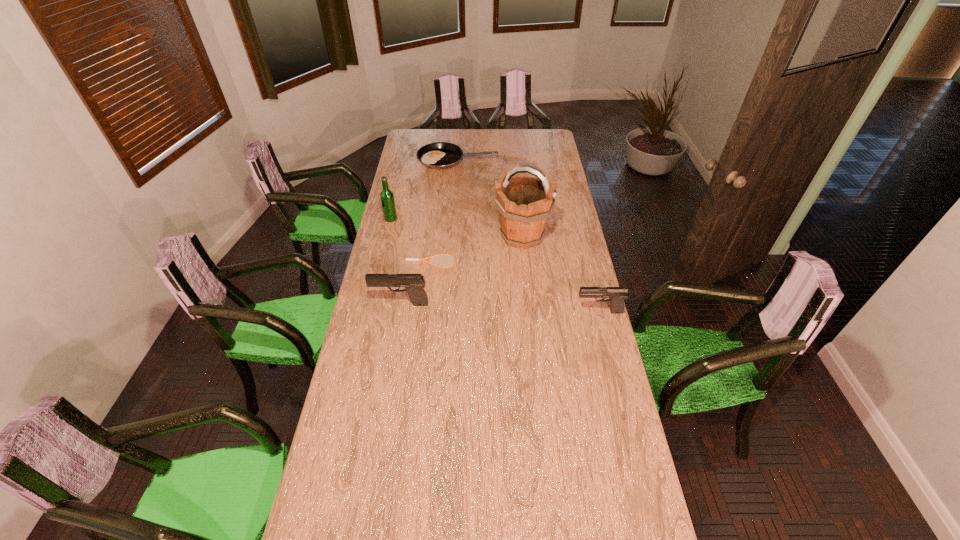
This screenshot has width=960, height=540. In order to click on free space located aim along the barrel of the shorter pistol in this screenshot , I will do `click(490, 312)`.

At what (x,y) coordinates should I click in order to perform the action: click on vacant space located 0.140m aim along the barrel of the shorter pistol. Please return your answer as a coordinate pair (x, y). This screenshot has width=960, height=540. Looking at the image, I should click on (540, 312).

The width and height of the screenshot is (960, 540). I want to click on blank space located 0.220m on the left of the bucket, so click(446, 237).

Locate an element on the screen. This screenshot has width=960, height=540. vacant space situated 0.050m on the left of the farthest object is located at coordinates (408, 160).

Where is `free region located on the front of the fifth shortest object`? free region located on the front of the fifth shortest object is located at coordinates (386, 239).

Where is `vacant region located on the front of the tennis racket`? vacant region located on the front of the tennis racket is located at coordinates (427, 285).

Find the location of a particular element. Image resolution: width=960 pixels, height=540 pixels. pistol present at the left edge is located at coordinates (414, 283).

Where is `frying pan that is at the left edge`? This screenshot has height=540, width=960. frying pan that is at the left edge is located at coordinates (440, 155).

The height and width of the screenshot is (540, 960). In order to click on beer bottle located at the left edge in this screenshot , I will do `click(387, 197)`.

Find the location of a particular element. The image size is (960, 540). tennis racket that is at the left edge is located at coordinates (431, 257).